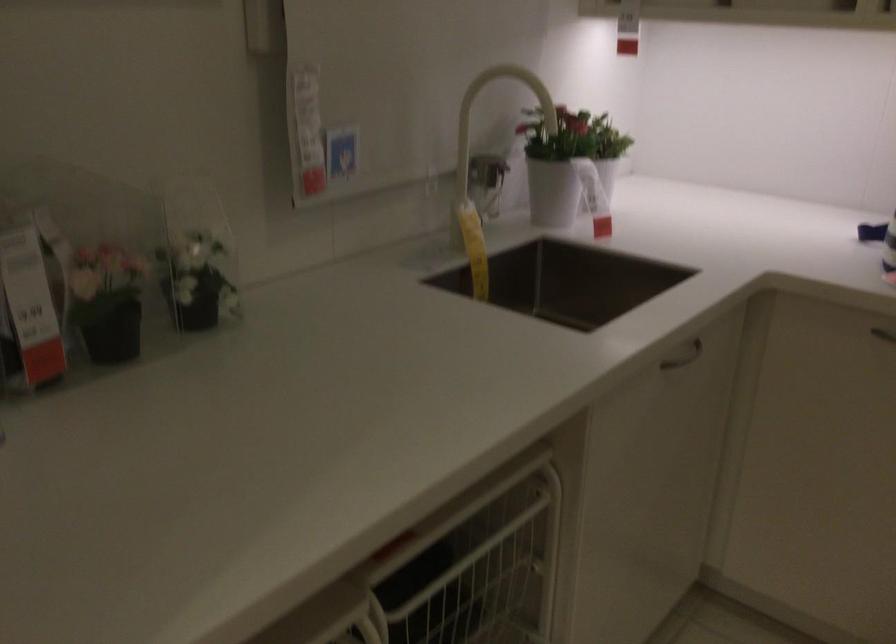
Find the location of `white wire basket`. white wire basket is located at coordinates (472, 571).